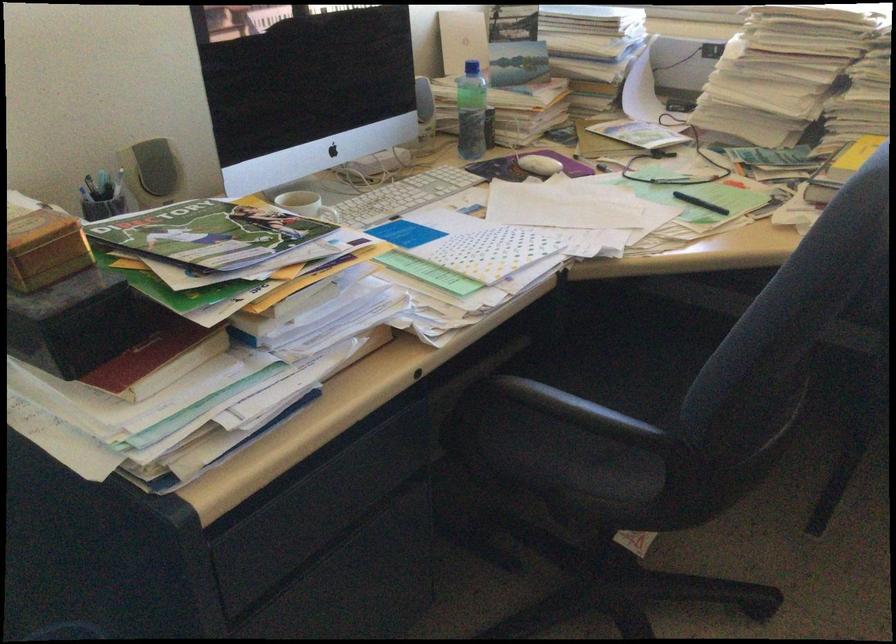
Locate an element on the screen. The image size is (896, 644). chair sitting surface is located at coordinates (618, 365).